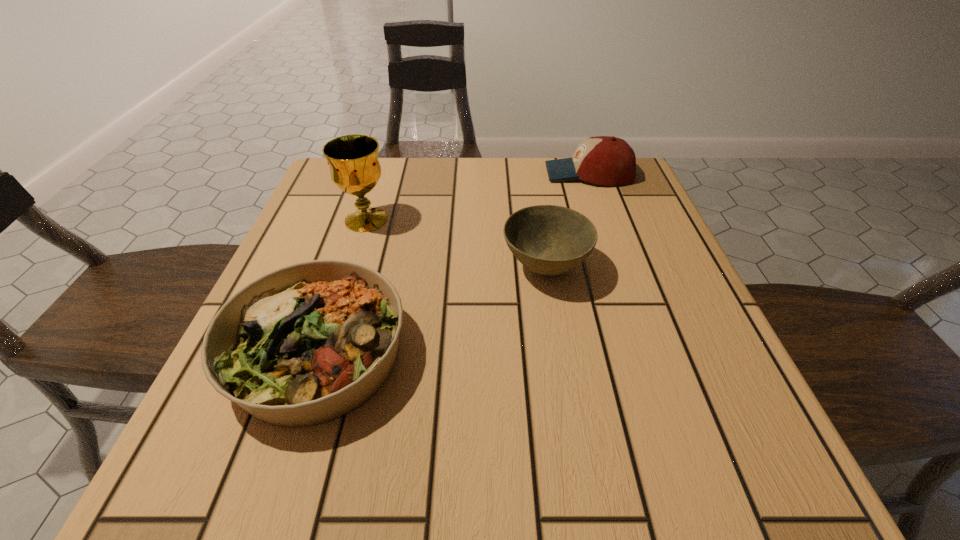
Image resolution: width=960 pixels, height=540 pixels. In order to click on the second farthest object in this screenshot , I will do `click(353, 160)`.

Identify the location of the tallest object. The image size is (960, 540). (353, 160).

This screenshot has width=960, height=540. I want to click on the farthest object, so click(604, 160).

Image resolution: width=960 pixels, height=540 pixels. I want to click on bowl, so click(550, 240).

Where is `salad plate`? salad plate is located at coordinates (308, 343).

Find the location of `vacant space located 0.110m on the right of the tallest object`. vacant space located 0.110m on the right of the tallest object is located at coordinates (442, 220).

Locate an element on the screen. free space located 0.320m on the front-facing side of the farthest object is located at coordinates (418, 174).

This screenshot has width=960, height=540. Identify the location of vacant space located 0.140m on the front-facing side of the farthest object. (490, 174).

Locate an element on the screen. vacant area located on the front-facing side of the farthest object is located at coordinates (394, 174).

Locate an element on the screen. Image resolution: width=960 pixels, height=540 pixels. vacant area located 0.280m on the left of the bowl is located at coordinates (357, 267).